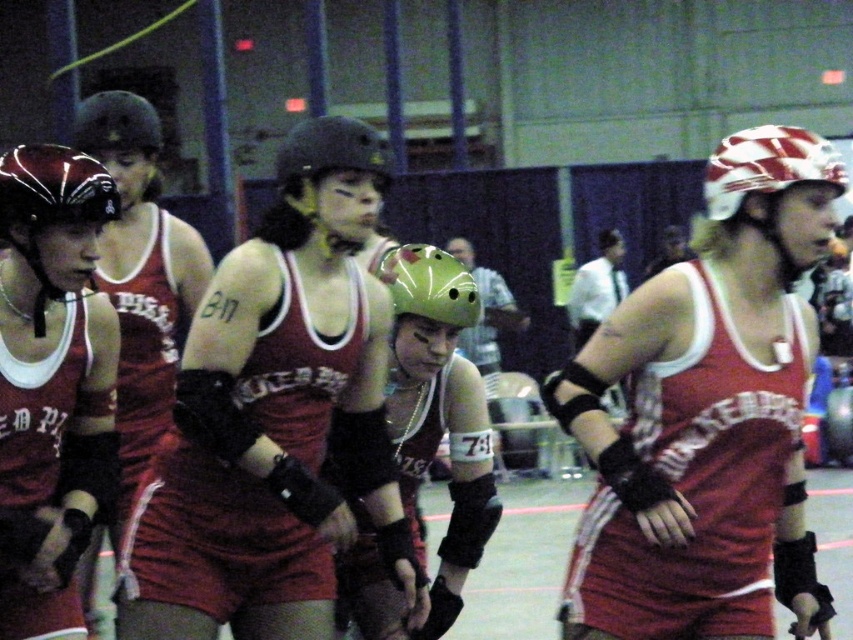
Who is shorter, green matte helmet at center or shiny black helmet at upper left?

green matte helmet at center

Is point (421, 250) closer to camera compared to point (126, 106)?

Yes, point (421, 250) is closer to viewer.

Identify the location of green matte helmet at center. This screenshot has width=853, height=640. (428, 285).

Is white checkered helmet at right taller than matte black helmet at center?

Indeed, white checkered helmet at right has a greater height compared to matte black helmet at center.

Which is below, white checkered helmet at right or matte black helmet at center?

white checkered helmet at right is lower down.

Is point (776, 172) closer to camera compared to point (364, 160)?

That is True.

Where is `white checkered helmet at right`? Image resolution: width=853 pixels, height=640 pixels. white checkered helmet at right is located at coordinates (763, 186).

Measure the distance from matte red helmet at center to matte black helmet at center.

The distance of matte red helmet at center from matte black helmet at center is 1.59 meters.

Who is more distant from viewer, [682,380] or [285,177]?

Point [285,177]

Where is `matte red helmet at center`? The height and width of the screenshot is (640, 853). matte red helmet at center is located at coordinates (706, 416).